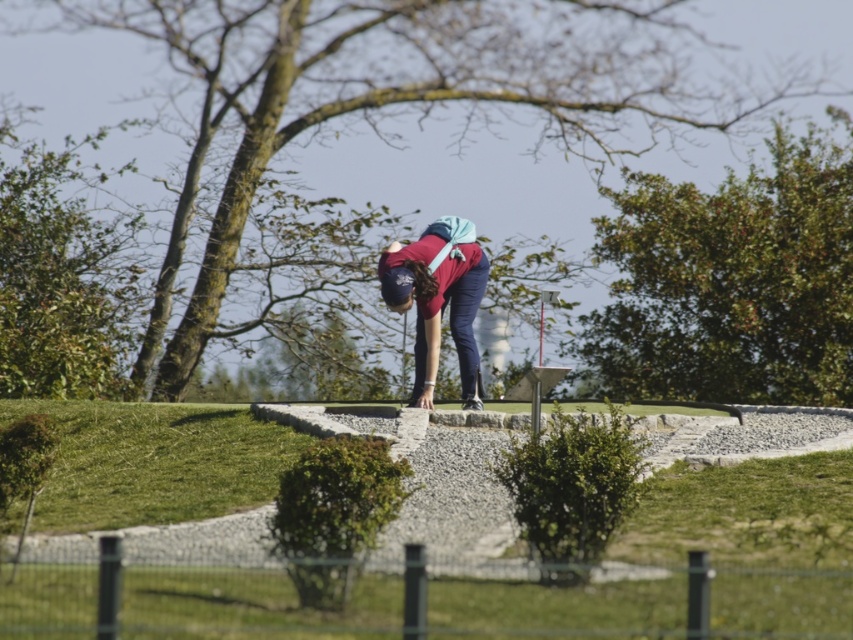
You are a golfer standing on the smooth gravel path at center. You want to pick up the matte red shirt at center to wipe your hands. Can you reach it without moving from your current position?

The smooth gravel path at center is positioned under matte red shirt at center, meaning the shirt is above the path. Since you are on the path, you can reach up to grab the matte red shirt at center.

You are a delivery drone with a 2 meter wingspan. You need to fly over the smooth gravel path at center and the matte red shirt at center to deliver a package. Is there enough space between them for your drone to pass safely?

The distance between the smooth gravel path at center and the matte red shirt at center is 6.44 meters, which is greater than the drone wingspan of 2 meters, so there is enough space for the drone to pass safely.